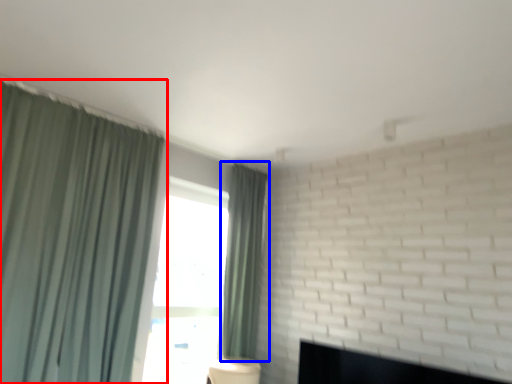
Question: Which object is further to the camera taking this photo, curtain (highlighted by a red box) or curtain (highlighted by a blue box)?

Choices:
 (A) curtain
 (B) curtain

Answer: (B)